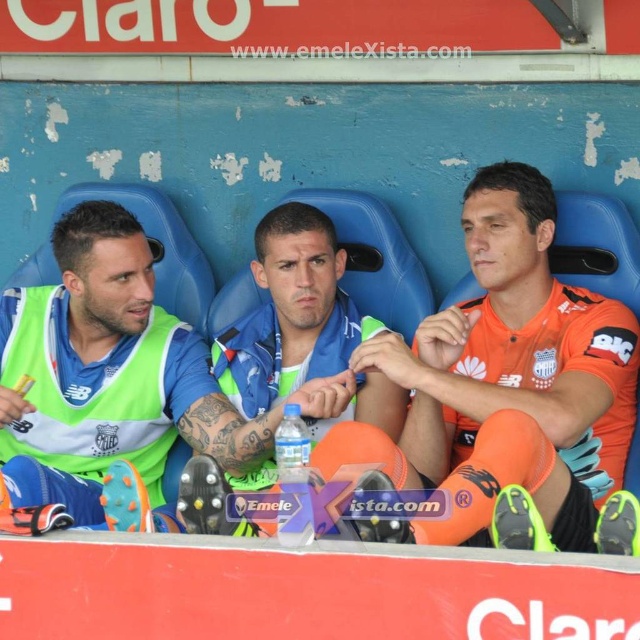
You are a photographer trying to capture a candid shot of both the green fabric jersey at center and the blue matte jersey at center. Since you want to ensure both are in focus, you need to know their vertical positions. Can you tell me which one is lower in the image?

The green fabric jersey at center is located below the blue matte jersey at center, so the green fabric jersey at center is lower in the image.

You are a photographer trying to capture a candid shot of the two athletes wearing the orange jersey at center and the green fabric jersey at center. Since you want to ensure both are visible in the frame, which jersey should you focus on first to account for their positioning?

The orange jersey at center is positioned under the green fabric jersey at center, so you should focus on the green fabric jersey at center first to ensure it doesn not block the orange one below it.

You are standing at the point marked by the coordinate point at (465, 460). You want to throw a ball to your teammate who is 2.42 meters away from you. Is the distance within the maximum throwing range of 3 meters?

Yes, the distance between you and your teammate is 2.42 meters, which is within the 3 meters maximum throwing range.